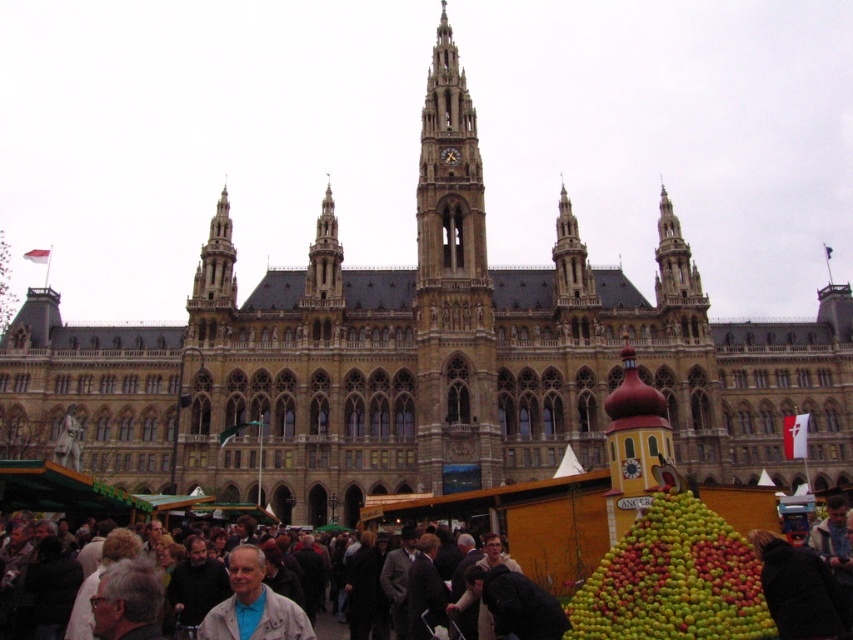
Locate an element on the screen. The height and width of the screenshot is (640, 853). green matte apples at lower right is located at coordinates (672, 579).

Is green matte apples at lower right to the right of golden stone tower at center from the viewer's perspective?

Correct, you'll find green matte apples at lower right to the right of golden stone tower at center.

Does point (695, 554) come in front of point (575, 221)?

That is True.

The height and width of the screenshot is (640, 853). What are the coordinates of `green matte apples at lower right` in the screenshot? It's located at (672, 579).

Can you confirm if golden stone tower at center is positioned above dark brown leather jacket at lower center?

Yes, golden stone tower at center is above dark brown leather jacket at lower center.

Which of these two, golden stone tower at center or dark brown leather jacket at lower center, stands shorter?

Standing shorter between the two is dark brown leather jacket at lower center.

Find the location of a particular element. The width and height of the screenshot is (853, 640). golden stone tower at center is located at coordinates (570, 260).

Who is higher up, light gray jacket at center or brown stone tower at upper center?

brown stone tower at upper center

Does light gray jacket at center have a greater width compared to brown stone tower at upper center?

Indeed, light gray jacket at center has a greater width compared to brown stone tower at upper center.

What do you see at coordinates (253, 605) in the screenshot? I see `light gray jacket at center` at bounding box center [253, 605].

Identify the location of light gray jacket at center. This screenshot has height=640, width=853. (253, 605).